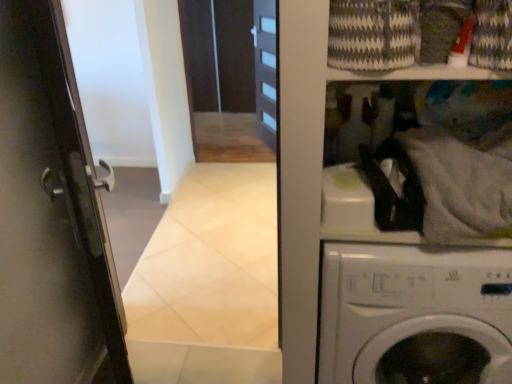
Question: Is the position of knitted wool laundry basket at upper right less distant than that of white matte washing machine at upper right?

Choices:
 (A) yes
 (B) no

Answer: (A)

Question: Does knitted wool laundry basket at upper right have a smaller size compared to white matte washing machine at upper right?

Choices:
 (A) no
 (B) yes

Answer: (B)

Question: From the image's perspective, is knitted wool laundry basket at upper right located above white matte washing machine at upper right?

Choices:
 (A) no
 (B) yes

Answer: (B)

Question: Can you confirm if knitted wool laundry basket at upper right is positioned to the right of white matte washing machine at upper right?

Choices:
 (A) no
 (B) yes

Answer: (A)

Question: Is knitted wool laundry basket at upper right shorter than white matte washing machine at upper right?

Choices:
 (A) no
 (B) yes

Answer: (B)

Question: From a real-world perspective, is knitted wool laundry basket at upper right below white matte washing machine at upper right?

Choices:
 (A) no
 (B) yes

Answer: (A)

Question: Is white matte washing machine at upper right turned away from knitted wool laundry basket at upper right?

Choices:
 (A) no
 (B) yes

Answer: (A)

Question: Is knitted wool laundry basket at upper right surrounded by white matte washing machine at upper right?

Choices:
 (A) no
 (B) yes

Answer: (A)

Question: Is white matte washing machine at upper right in contact with knitted wool laundry basket at upper right?

Choices:
 (A) no
 (B) yes

Answer: (A)

Question: Would you say white matte washing machine at upper right is outside knitted wool laundry basket at upper right?

Choices:
 (A) no
 (B) yes

Answer: (B)

Question: Does white matte washing machine at upper right have a lesser width compared to knitted wool laundry basket at upper right?

Choices:
 (A) yes
 (B) no

Answer: (B)

Question: Is white matte washing machine at upper right taller than knitted wool laundry basket at upper right?

Choices:
 (A) yes
 (B) no

Answer: (A)

Question: Is point (378, 46) closer or farther from the camera than point (478, 266)?

Choices:
 (A) farther
 (B) closer

Answer: (B)